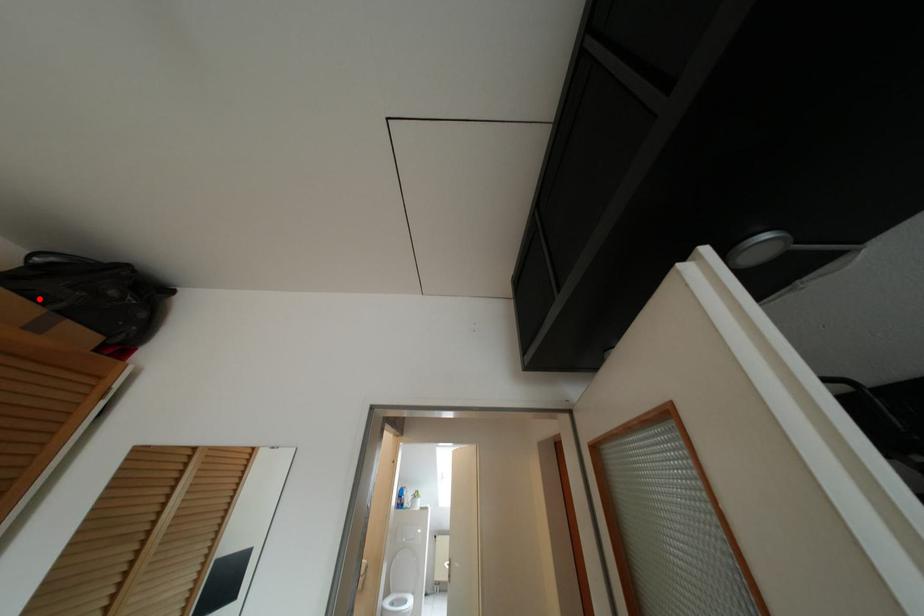
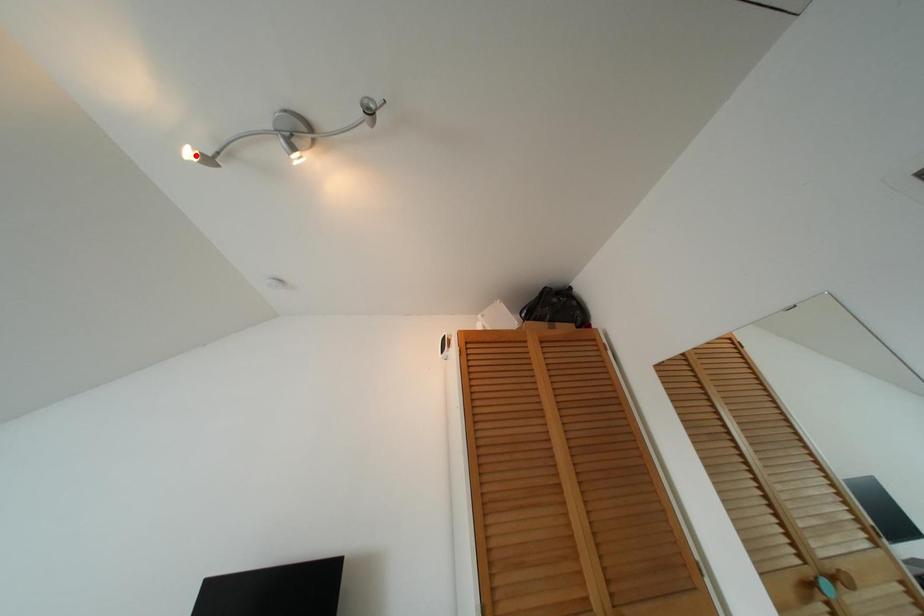
I am providing you with two images of the same scene from different viewpoints. A red point is marked on the first image and another point is marked on the second image. Do the highlighted points in image1 and image2 indicate the same real-world spot?

No